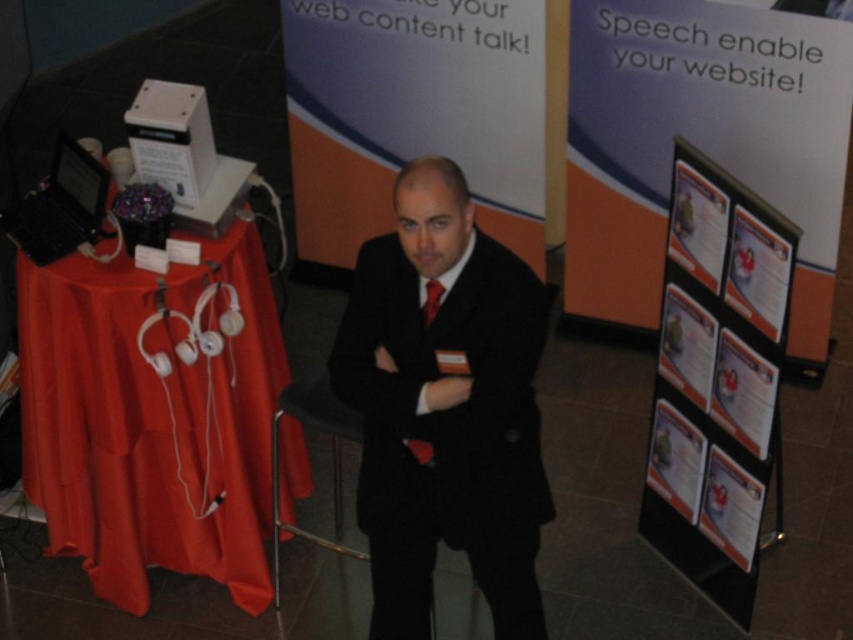
Question: Which object appears closest to the camera in this image?

Choices:
 (A) black matte suit at center
 (B) orange fabric table at left
 (C) shiny red tie at center

Answer: (A)

Question: Can you confirm if red silk tie at center is positioned above shiny red tie at center?

Choices:
 (A) yes
 (B) no

Answer: (A)

Question: Is red silk tie at center to the right of shiny red tie at center from the viewer's perspective?

Choices:
 (A) no
 (B) yes

Answer: (B)

Question: Which of the following is the farthest from the observer?

Choices:
 (A) black matte suit at center
 (B) red silk tie at center
 (C) orange fabric table at left

Answer: (C)

Question: Can you confirm if orange fabric table at left is positioned to the right of shiny red tie at center?

Choices:
 (A) no
 (B) yes

Answer: (A)

Question: Which point appears farthest from the camera in this image?

Choices:
 (A) (125, 288)
 (B) (408, 445)
 (C) (432, 304)
 (D) (473, 564)

Answer: (A)